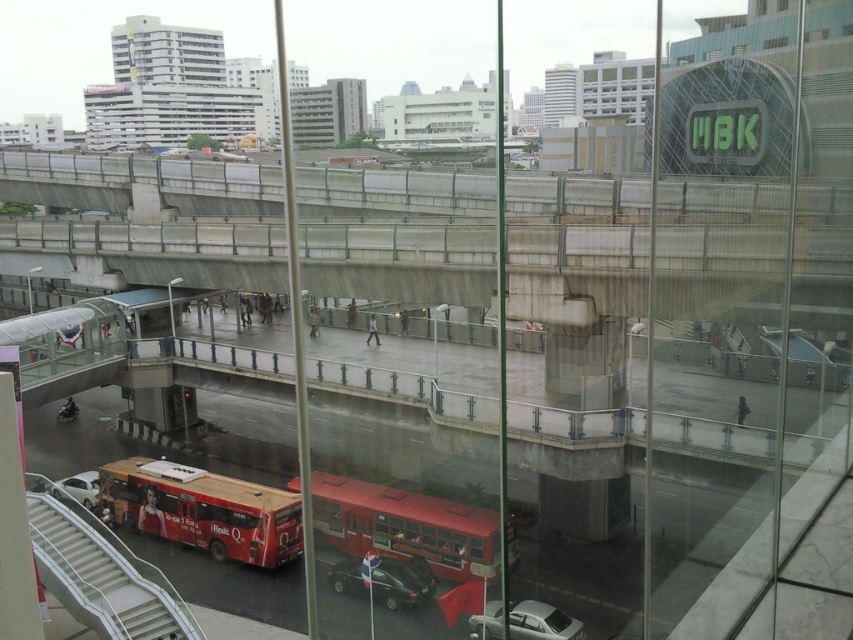
Question: From the image, what is the correct spatial relationship of red matte bus at lower left in relation to shiny red bus at center?

Choices:
 (A) below
 (B) above

Answer: (B)

Question: Does white plastic escalator at lower left appear on the left side of shiny red bus at center?

Choices:
 (A) no
 (B) yes

Answer: (B)

Question: Among these points, which one is farthest from the camera?

Choices:
 (A) (59, 566)
 (B) (469, 552)
 (C) (300, 541)

Answer: (C)

Question: Which object is positioned closest to the white plastic escalator at lower left?

Choices:
 (A) red matte bus at lower left
 (B) shiny red bus at center

Answer: (A)

Question: Which object is the closest to the shiny red bus at center?

Choices:
 (A) red matte bus at lower left
 (B) white plastic escalator at lower left

Answer: (A)

Question: Does white plastic escalator at lower left appear on the right side of shiny red bus at center?

Choices:
 (A) no
 (B) yes

Answer: (A)